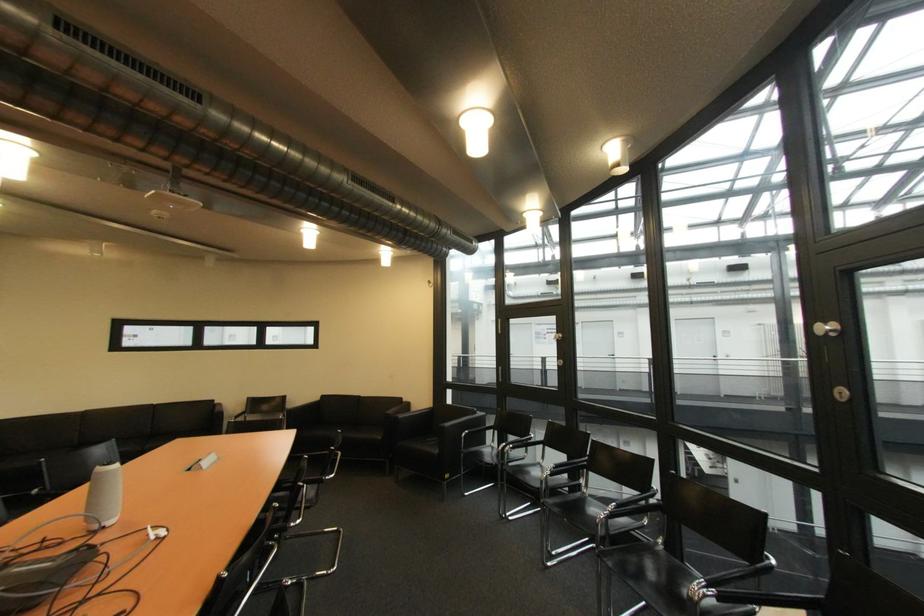
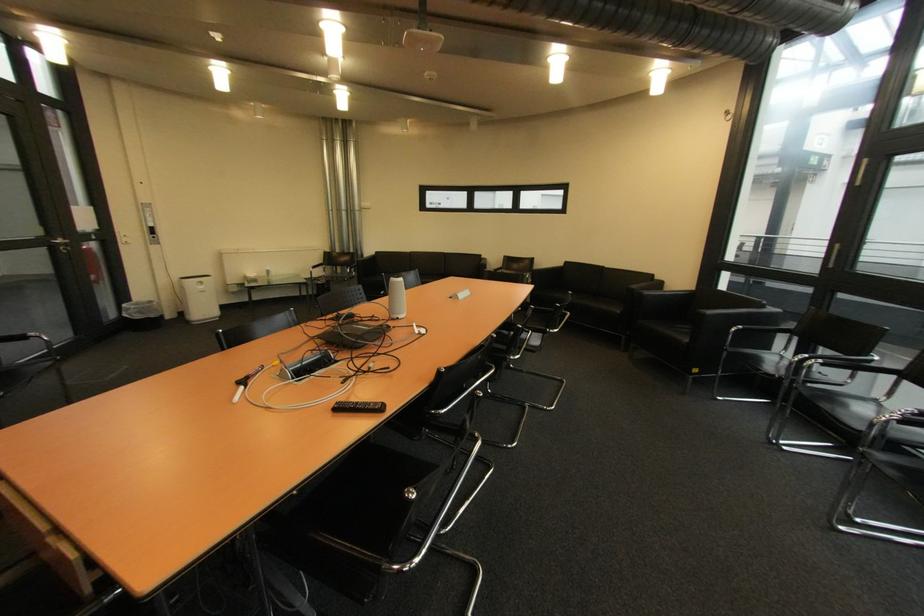
Locate, in the second image, the point that corresponds to (x=107, y=469) in the first image.

(400, 281)